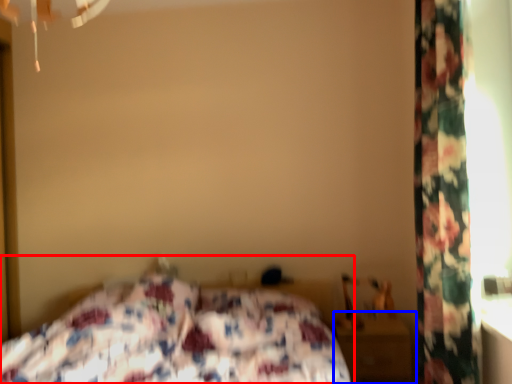
Question: Among these objects, which one is farthest to the camera, bed (highlighted by a red box) or nightstand (highlighted by a blue box)?

Choices:
 (A) bed
 (B) nightstand

Answer: (B)